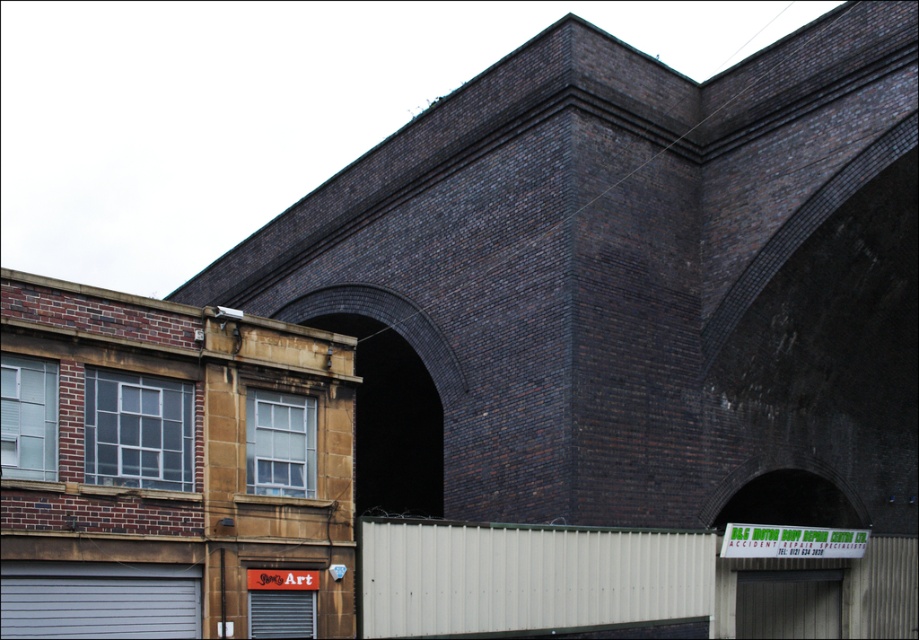
Question: Does dark brick archway at center appear on the left side of gray matte garage door at lower left?

Choices:
 (A) yes
 (B) no

Answer: (B)

Question: Which object appears closest to the camera in this image?

Choices:
 (A) dark brick archway at center
 (B) gray matte garage door at lower left

Answer: (B)

Question: Which of the following is the farthest from the observer?

Choices:
 (A) (458, 378)
 (B) (173, 572)

Answer: (A)

Question: Is dark brick archway at center bigger than gray matte garage door at lower left?

Choices:
 (A) yes
 (B) no

Answer: (A)

Question: Is dark brick archway at center wider than gray matte garage door at lower left?

Choices:
 (A) yes
 (B) no

Answer: (A)